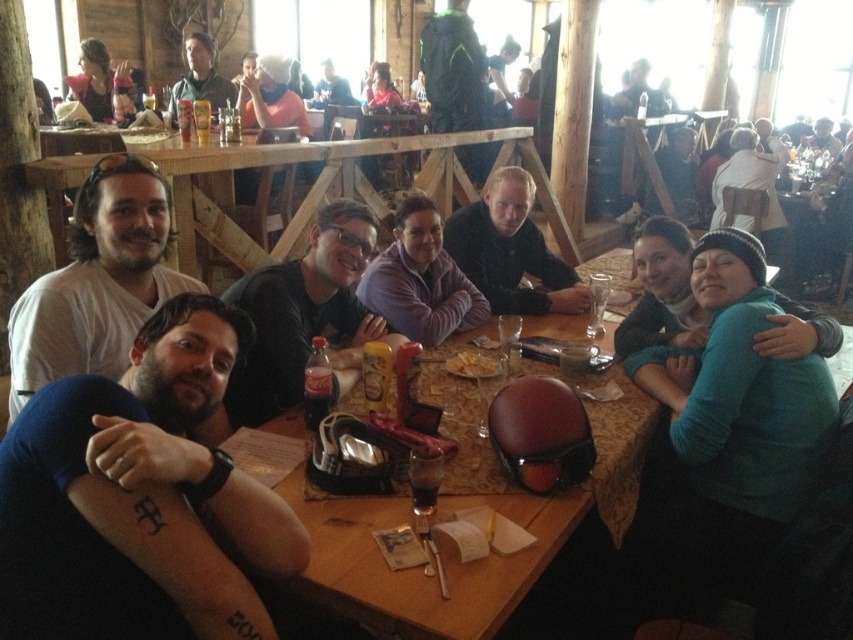
You are sitting at the wooden table at center and want to hand a menu to the person wearing the dark blue shirt at center. Can you reach them directly without moving from your seat?

The dark blue shirt at center is closer to the viewer than the wooden table at center, so you can reach them directly without moving from your seat.

In the scene shown: You are sitting at the wooden table at center and want to reach the purple sweater at center. In which direction should you move to get it?

The wooden table at center is to the right of the purple sweater at center, so you should move to your left to reach the purple sweater at center.